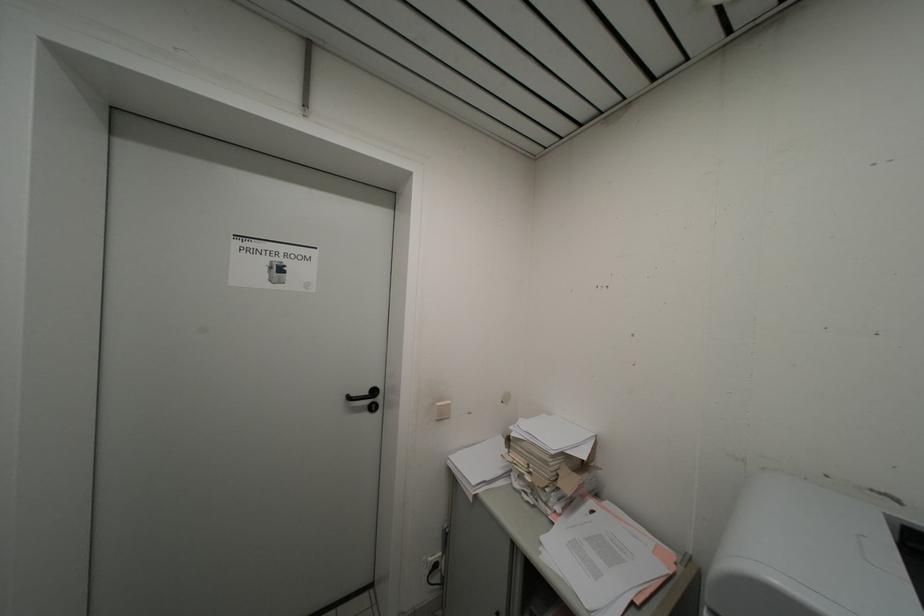
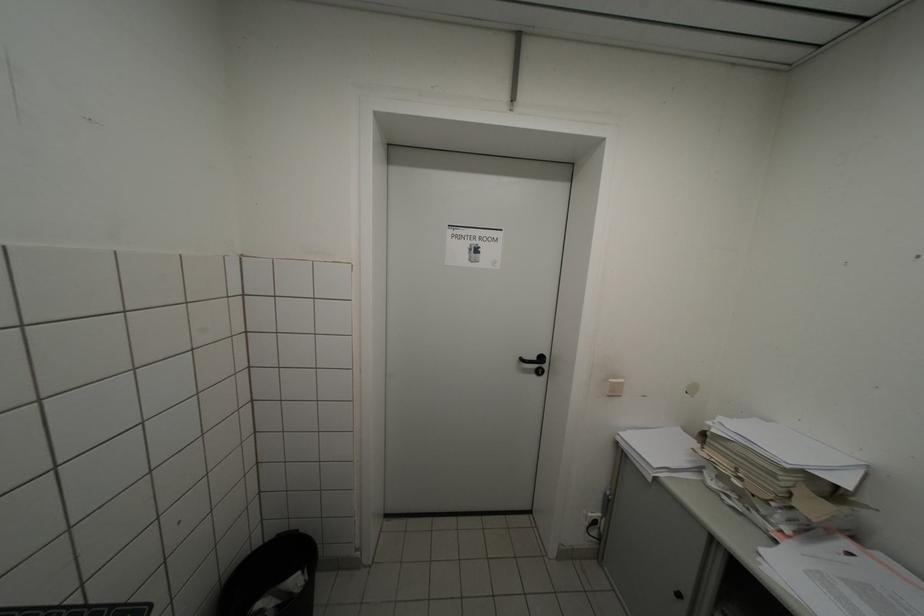
Question: The images are taken continuously from a first-person perspective. In which direction is your viewpoint rotating?

Choices:
 (A) Left
 (B) Right
 (C) Up
 (D) Down

Answer: (A)